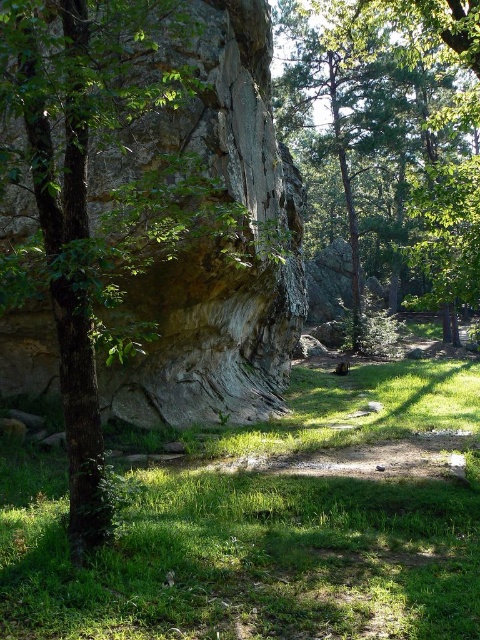
Is rough stone rock face at center below green leafy tree at center?

Indeed, rough stone rock face at center is positioned under green leafy tree at center.

Can you confirm if rough stone rock face at center is positioned above green leafy tree at center?

Incorrect, rough stone rock face at center is not positioned above green leafy tree at center.

What do you see at coordinates (216, 248) in the screenshot?
I see `rough stone rock face at center` at bounding box center [216, 248].

The height and width of the screenshot is (640, 480). In order to click on rough stone rock face at center in this screenshot , I will do `click(216, 248)`.

Is point (148, 576) more distant than point (472, 124)?

No, (148, 576) is in front of (472, 124).

Which of these two, green grassy at center or green leafy tree at center, stands shorter?

green grassy at center

Image resolution: width=480 pixels, height=640 pixels. What do you see at coordinates (267, 522) in the screenshot? I see `green grassy at center` at bounding box center [267, 522].

Where is `green grassy at center`? green grassy at center is located at coordinates (267, 522).

Does point (10, 496) lie behind point (252, 317)?

No, (10, 496) is closer to viewer.

Locate an element on the screen. Image resolution: width=480 pixels, height=640 pixels. green grassy at center is located at coordinates (267, 522).

Locate an element on the screen. The image size is (480, 640). green grassy at center is located at coordinates (267, 522).

Locate an element on the screen. The width and height of the screenshot is (480, 640). green grassy at center is located at coordinates (267, 522).